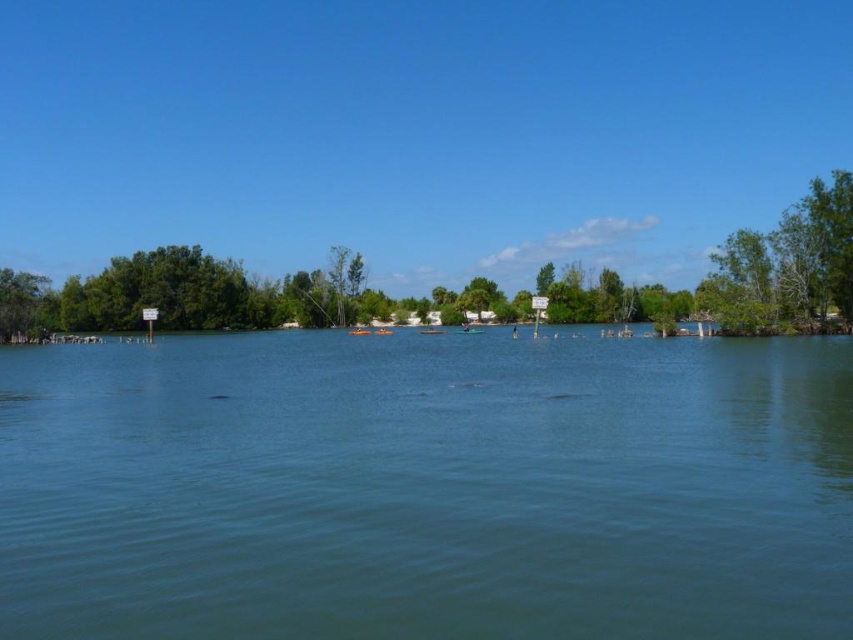
Is point (753, 634) farther from camera compared to point (28, 333)?

No.

Identify the location of clear blue water at center. (427, 488).

Is point (733, 529) closer to viewer compared to point (26, 332)?

That is True.

Image resolution: width=853 pixels, height=640 pixels. In order to click on clear blue water at center in this screenshot , I will do `click(427, 488)`.